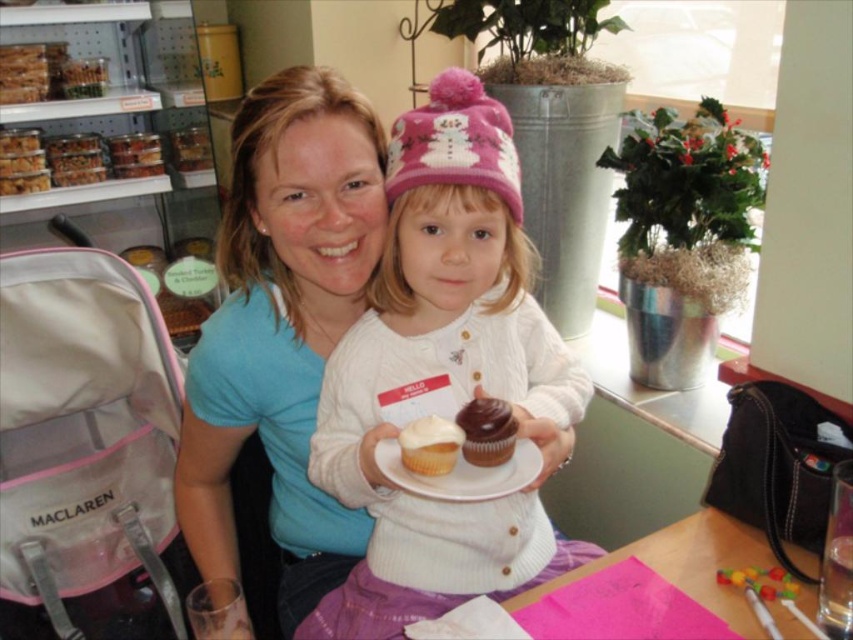
The height and width of the screenshot is (640, 853). Describe the element at coordinates (462, 474) in the screenshot. I see `white paper plate at center` at that location.

Where is `white paper plate at center`? white paper plate at center is located at coordinates tap(462, 474).

Is the position of matte blue shirt at center less distant than that of white paper plate at center?

No, it is not.

Does matte blue shirt at center appear on the right side of white paper plate at center?

Incorrect, matte blue shirt at center is not on the right side of white paper plate at center.

At what (x,y) coordinates should I click in order to perform the action: click on matte blue shirt at center. Please return your answer as a coordinate pair (x, y). Looking at the image, I should click on (282, 326).

You are a GUI agent. You are given a task and a screenshot of the screen. Output one action in this format:
    pyautogui.click(x=<x>, y=<y>)
    Task: Click on the matte blue shirt at center
    This screenshot has height=640, width=853.
    Given the screenshot: What is the action you would take?
    pyautogui.click(x=282, y=326)

Does point (432, 209) come closer to viewer compared to point (457, 424)?

No, it is behind (457, 424).

Measure the distance from white knit sweater at center to chocolate matte muffin at center.

white knit sweater at center is 23.36 centimeters from chocolate matte muffin at center.

Who is more distant from viewer, (419,164) or (491,465)?

Positioned behind is point (419,164).

Locate an element on the screen. The image size is (853, 640). white knit sweater at center is located at coordinates (442, 372).